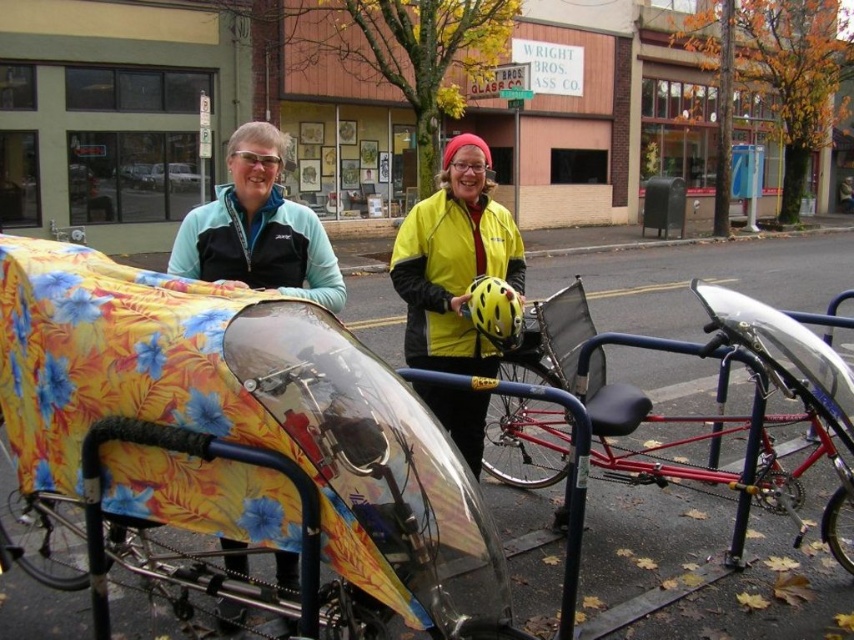
From the picture: You are a delivery person who needs to load a package onto the metallic red bicycle at center. The package is taller than the yellow matte jacket at center. Can the package fit on the bicycle?

The metallic red bicycle at center is shorter than the yellow matte jacket at center. Since the package is taller than the yellow matte jacket at center, it would be taller than the bicycle, so the package cannot fit on the metallic red bicycle at center.

You are standing in the street scene and want to reach the point marked at coordinates [542,308]. If you take three steps forward, each step covering 1.2 meters, will you reach that point?

After taking three steps forward, each covering 1.2 meters, you would have moved 3.6 meters. Since the point is 4.02 meters away from the viewer, you would still be 0.42 meters short of reaching it.